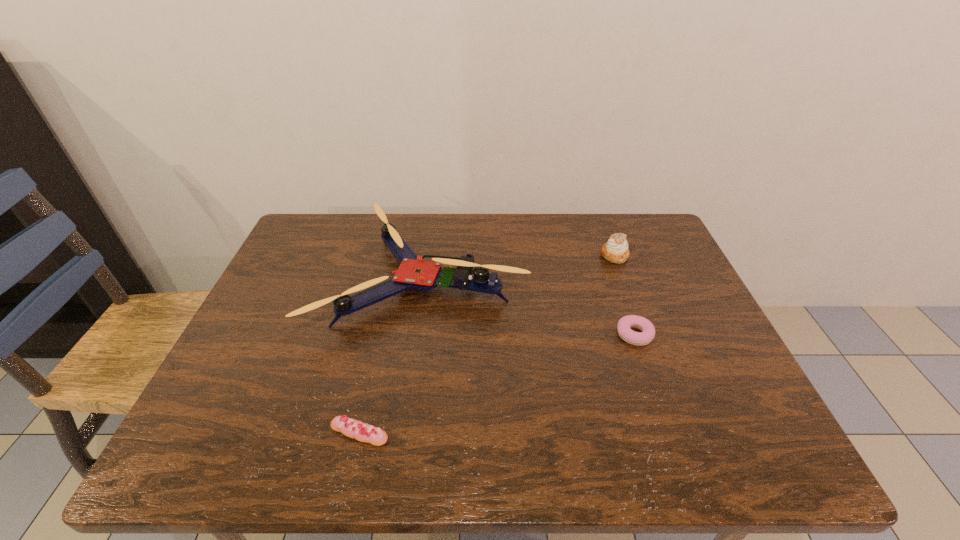
I want to click on pastry located in the far edge section of the desktop, so click(616, 250).

At what (x,y) coordinates should I click in order to perform the action: click on object that is at the near edge. Please return your answer as a coordinate pair (x, y). Image resolution: width=960 pixels, height=540 pixels. Looking at the image, I should click on (363, 432).

Identify the location of object that is at the left edge. Image resolution: width=960 pixels, height=540 pixels. (413, 273).

Where is `object present at the far left corner`? object present at the far left corner is located at coordinates (413, 273).

You are a GUI agent. You are given a task and a screenshot of the screen. Output one action in this format:
    pyautogui.click(x=<x>, y=<y>)
    Task: Click on the object located in the far right corner section of the desktop
    
    Given the screenshot: What is the action you would take?
    pyautogui.click(x=616, y=250)

In the image, there is a desktop. What are the coordinates of `free space at the far edge` in the screenshot? It's located at (546, 242).

I want to click on free space at the near edge, so 613,451.

In the image, there is a desktop. At what (x,y) coordinates should I click in order to perform the action: click on vacant space at the left edge. Please return your answer as a coordinate pair (x, y). Looking at the image, I should click on (251, 379).

The width and height of the screenshot is (960, 540). In order to click on vacant space at the right edge of the desktop in this screenshot , I will do `click(641, 274)`.

The width and height of the screenshot is (960, 540). In the image, there is a desktop. Find the location of `vacant area at the far left corner`. vacant area at the far left corner is located at coordinates (311, 218).